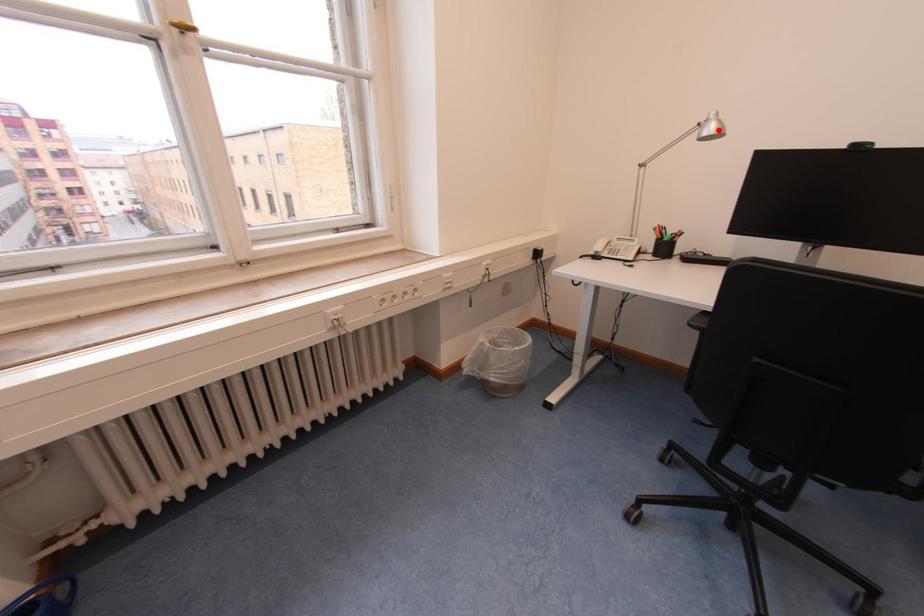
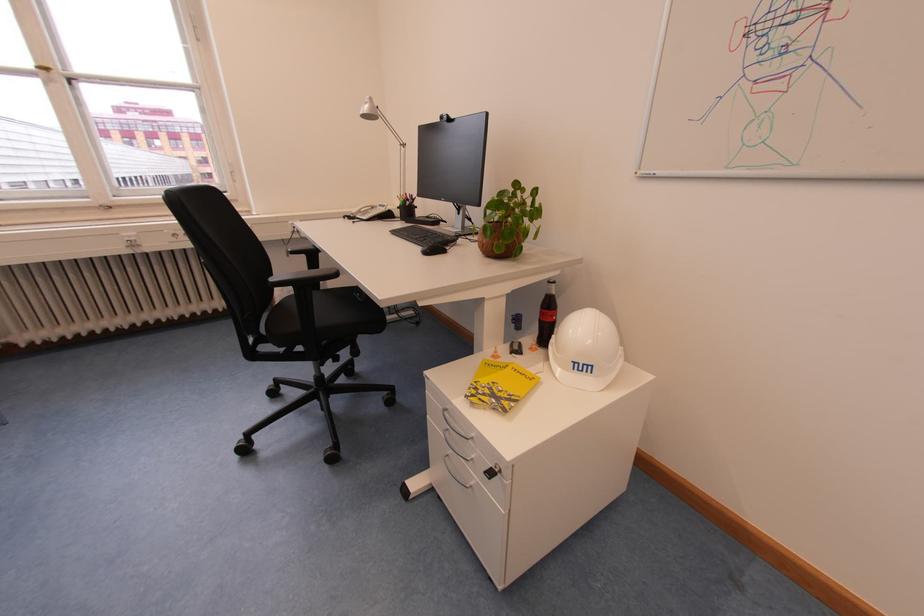
Locate, in the second image, the point that corresponds to the highlighted location in the first image.

(372, 111)